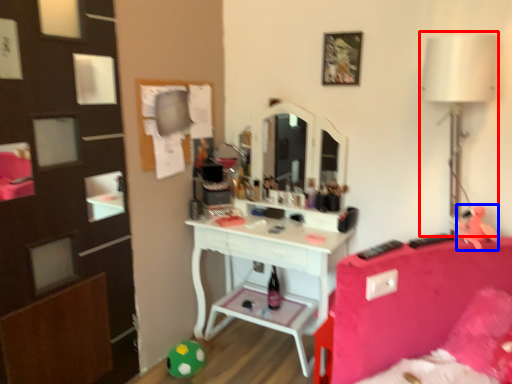
Question: Which of the following is the farthest to the observer, table lamp (highlighted by a red box) or toy (highlighted by a blue box)?

Choices:
 (A) table lamp
 (B) toy

Answer: (B)